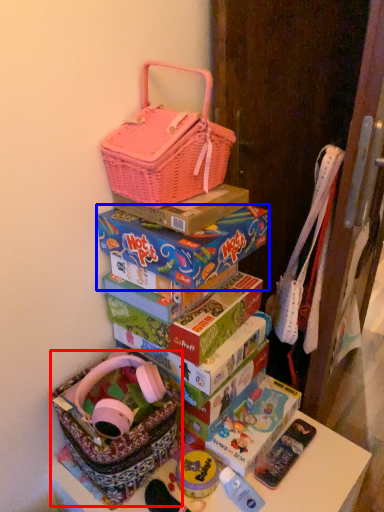
Question: Which object is closer to the camera taking this photo, gift basket (highlighted by a red box) or box (highlighted by a blue box)?

Choices:
 (A) gift basket
 (B) box

Answer: (A)